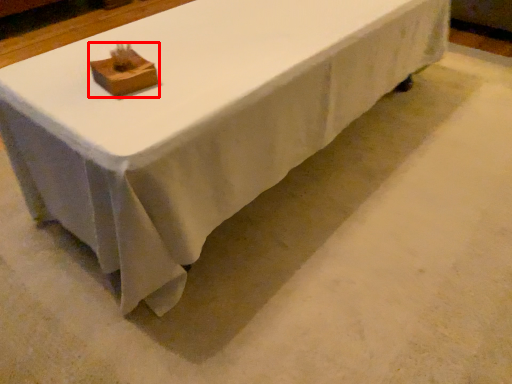
Question: In this image, where is block (annotated by the red box) located relative to table?

Choices:
 (A) right
 (B) left

Answer: (B)